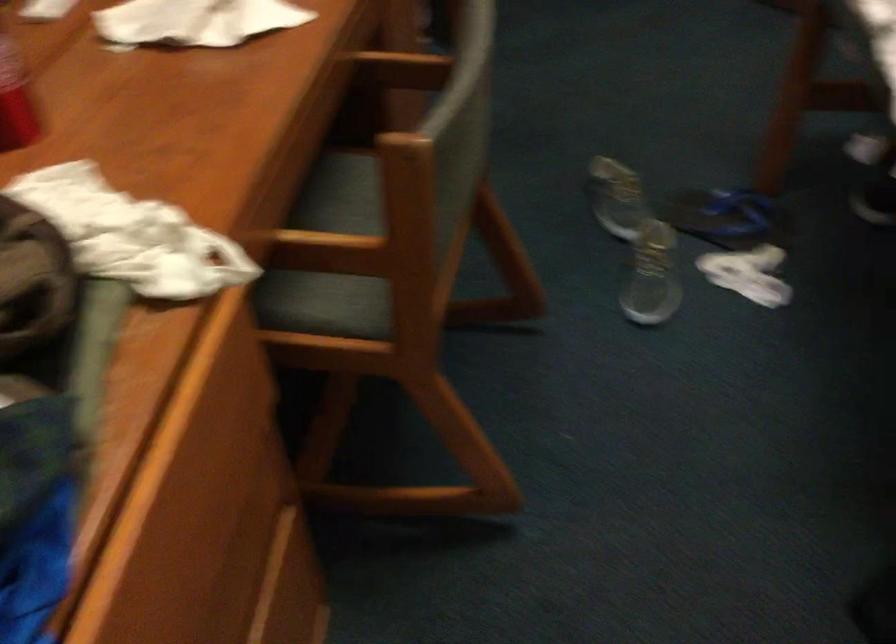
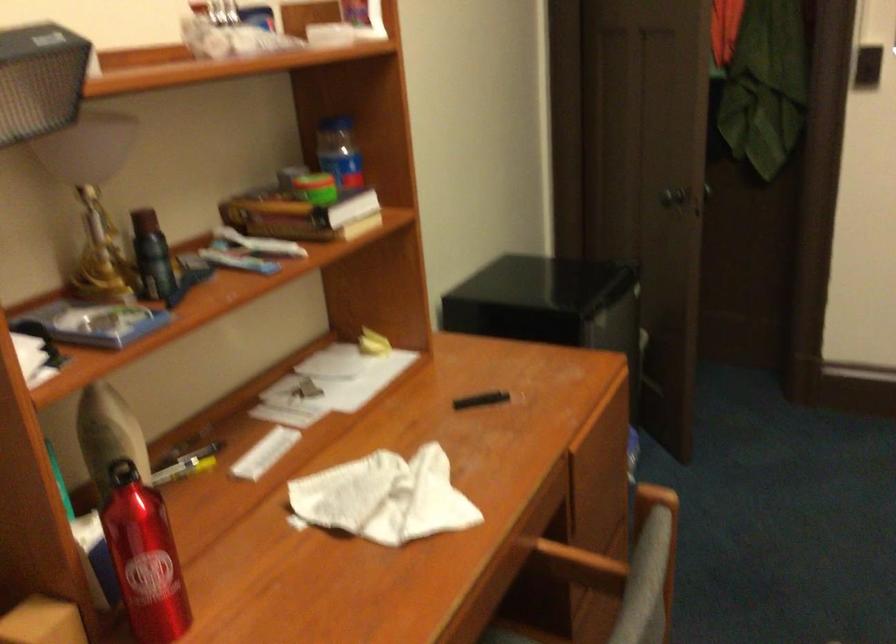
How did the camera likely rotate?

The rotation direction of the camera is left-up.